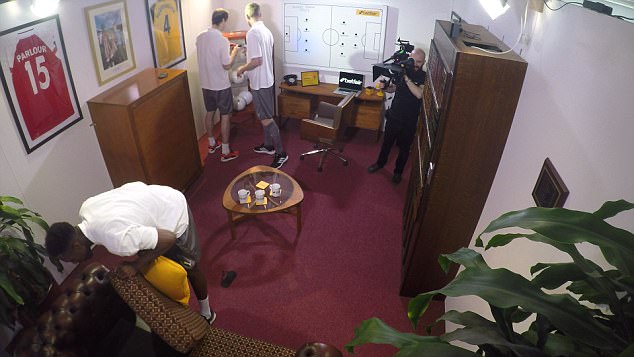
Where is `coffee mug`? coffee mug is located at coordinates (243, 194), (259, 197), (276, 188).